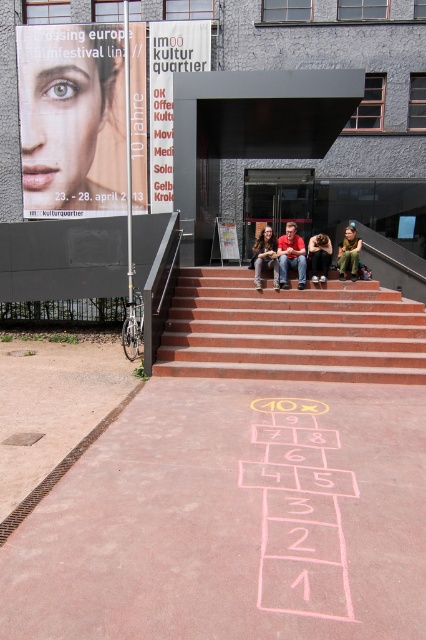
You are standing at the base of the red stairs in front of the modern building. You want to place a 1.5 meter long banner between the matte black poster at upper left and the jeans at center. Can you fit it there without overlapping either object?

The distance between the matte black poster at upper left and the jeans at center is 15.14 meters. Since the banner is only 1.5 meters long, there is sufficient space to place it between them without overlapping either object.

You are a tourist in Linz and want to find the film festival dates. You see a white paper sign at upper center and a white paper poster at center. Which one has a wider surface area?

The white paper sign at upper center has a wider surface area because its width surpasses that of the white paper poster at center.

You are a tourist in Linz and want to find the entrance to the film festival venue. You see a white paper sign at upper center and a white paper poster at center. Which one is located higher up?

The white paper sign at upper center is positioned over the white paper poster at center, meaning it is higher up.